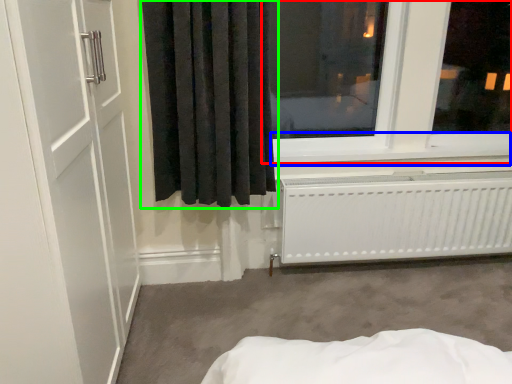
Question: Estimate the real-world distances between objects in this image. Which object is closer to window (highlighted by a red box), window sill (highlighted by a blue box) or curtain (highlighted by a green box)?

Choices:
 (A) window sill
 (B) curtain

Answer: (A)